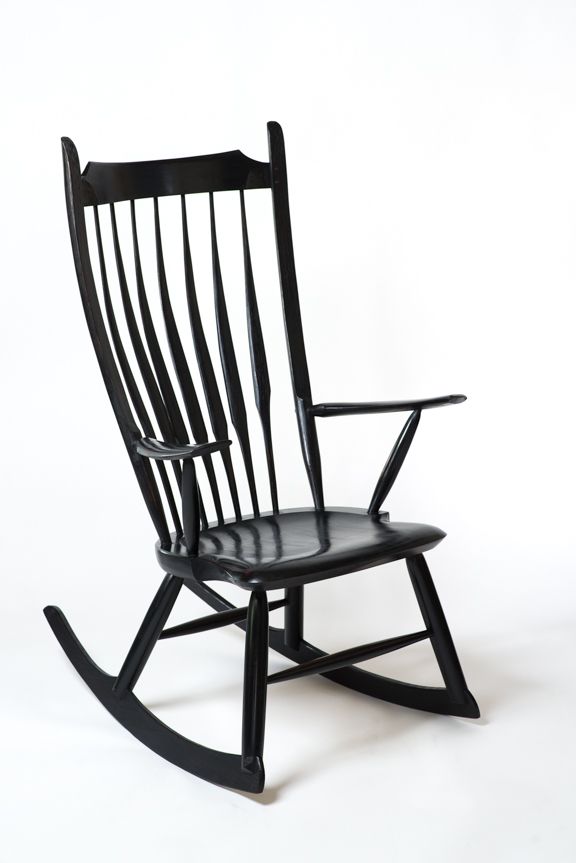
Where is `the top of chair`? This screenshot has width=576, height=863. the top of chair is located at coordinates (67, 140), (272, 123).